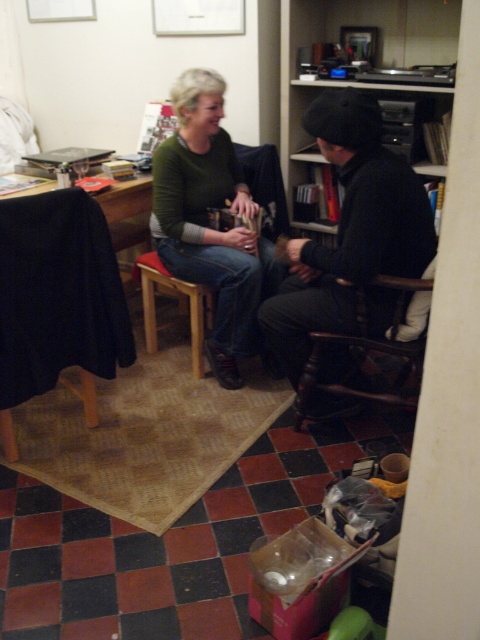
Question: Which is farther from the wooden bookshelf at upper center?

Choices:
 (A) black fabric-covered table at left
 (B) matte green sweater at center

Answer: (A)

Question: Among these objects, which one is nearest to the camera?

Choices:
 (A) dark woolen hat at center
 (B) matte green sweater at center
 (C) black fabric-covered table at left
 (D) wooden bookshelf at upper center

Answer: (A)

Question: From the image, what is the correct spatial relationship of matte green sweater at center in relation to wooden bookshelf at upper center?

Choices:
 (A) right
 (B) left

Answer: (B)

Question: Is wooden bookshelf at upper center bigger than black fabric-covered table at left?

Choices:
 (A) no
 (B) yes

Answer: (B)

Question: Does dark woolen hat at center have a lesser width compared to wooden bookshelf at upper center?

Choices:
 (A) yes
 (B) no

Answer: (A)

Question: Which point is farther to the camera?

Choices:
 (A) (300, 241)
 (B) (200, 81)

Answer: (B)